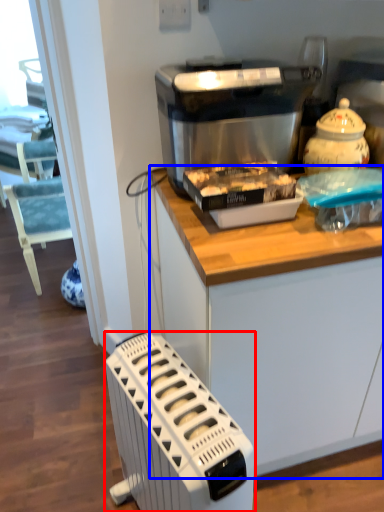
Question: Which object is further to the camera taking this photo, home appliance (highlighted by a red box) or cabinetry (highlighted by a blue box)?

Choices:
 (A) home appliance
 (B) cabinetry

Answer: (B)